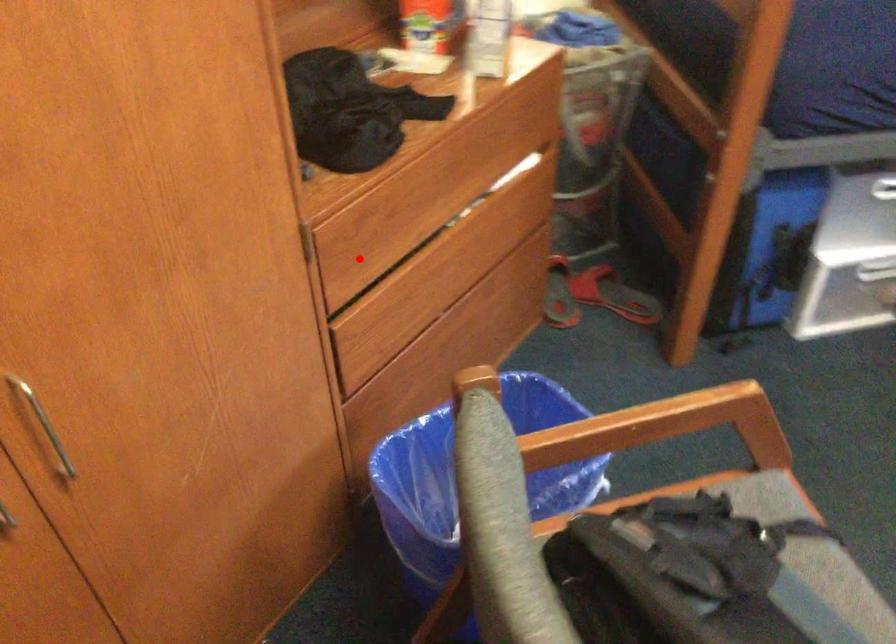
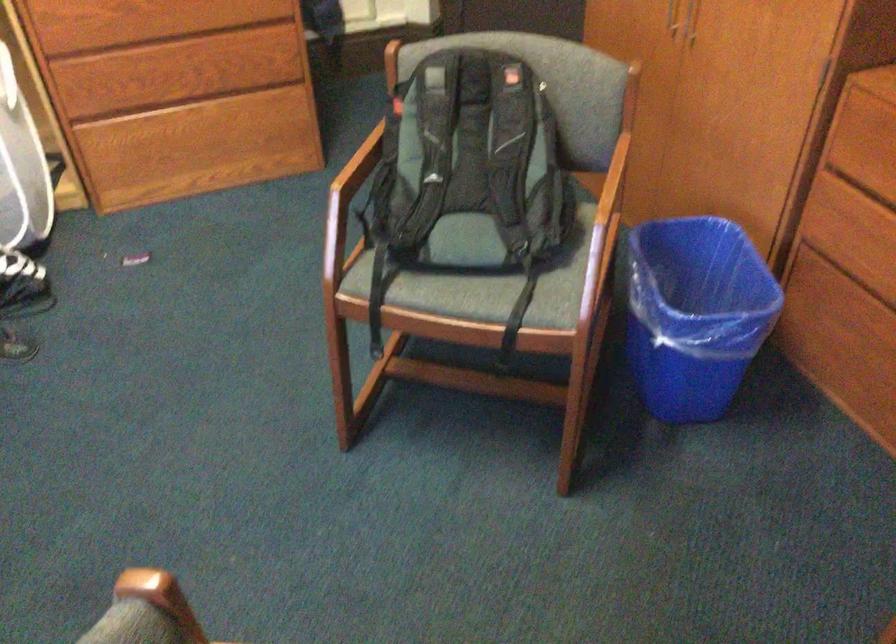
Question: I am providing you with two images of the same scene from different viewpoints. A red point is marked on the first image. At the location where the point appears in image 1, is it still visible in image 2?

Choices:
 (A) Yes
 (B) No

Answer: (A)